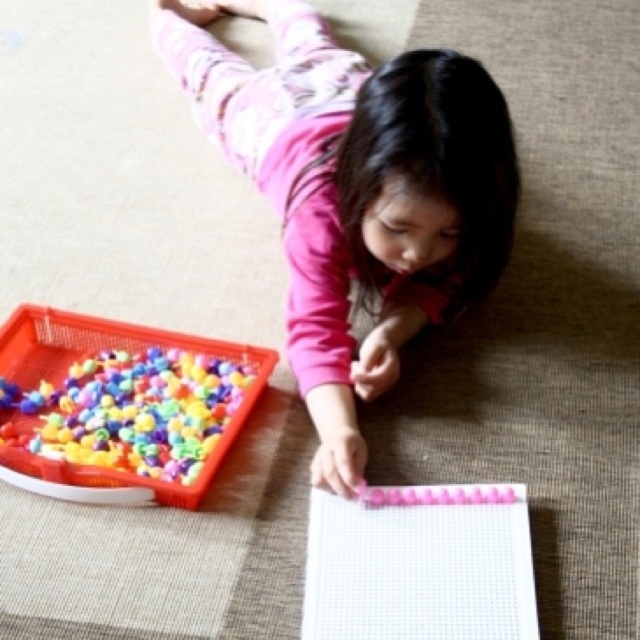
Question: Among these points, which one is farthest from the camera?

Choices:
 (A) (445, 172)
 (B) (173, 394)

Answer: (B)

Question: Does pink matte fabric at center have a larger size compared to multicolored plastic beads at lower left?

Choices:
 (A) yes
 (B) no

Answer: (A)

Question: Can you confirm if pink matte fabric at center is thinner than multicolored plastic beads at lower left?

Choices:
 (A) yes
 (B) no

Answer: (B)

Question: Which point appears closest to the camera in this image?

Choices:
 (A) (150, 356)
 (B) (376, 324)

Answer: (A)

Question: Is pink matte fabric at center bigger than multicolored plastic beads at lower left?

Choices:
 (A) no
 (B) yes

Answer: (B)